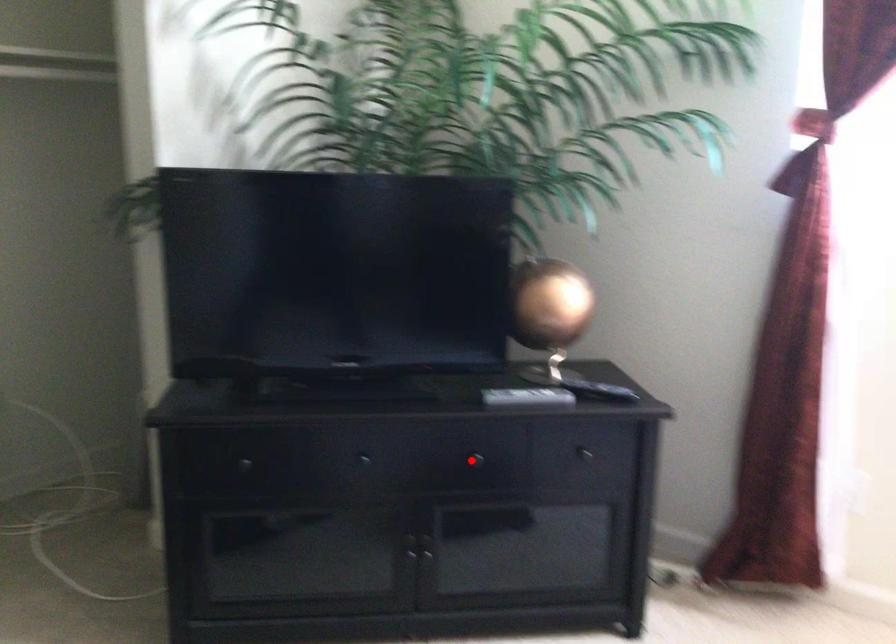
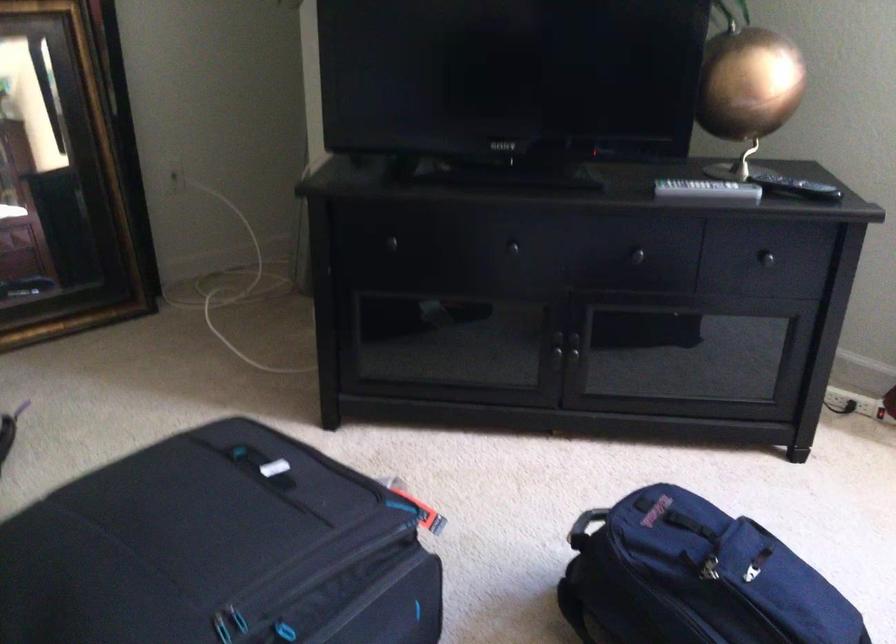
Question: I am providing you with two images of the same scene from different viewpoints. Image1 has a red point marked. In image2, the corresponding 3D location appears at what relative position? Reply with the corresponding letter.

Choices:
 (A) Closer
 (B) Farther

Answer: (A)